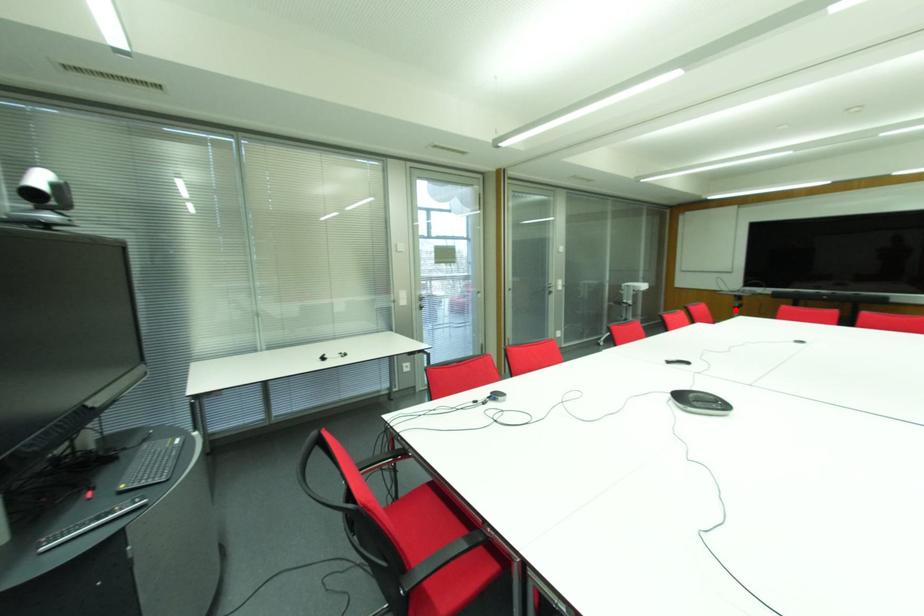
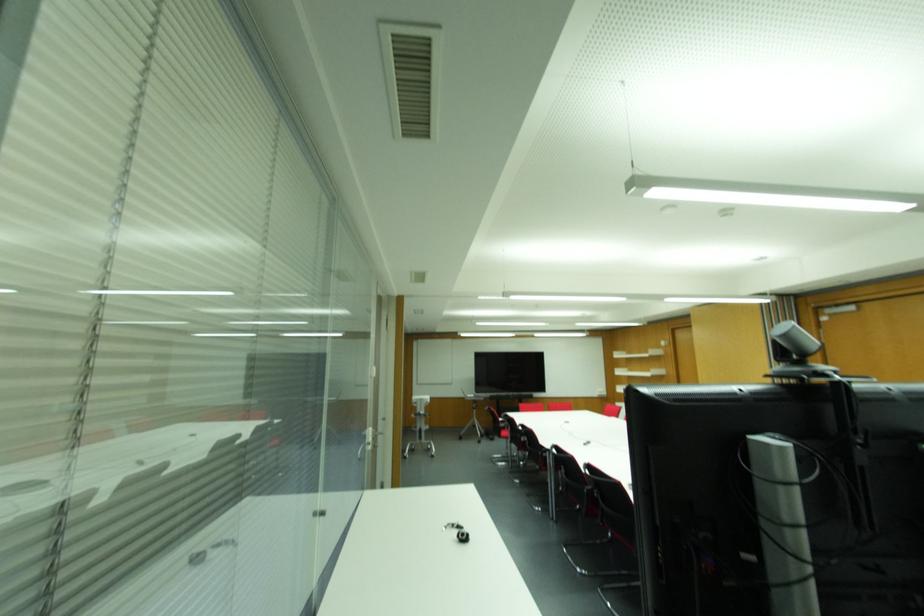
Where in the second image is the point corresponding to the highlighted location from the first image?

(473, 410)